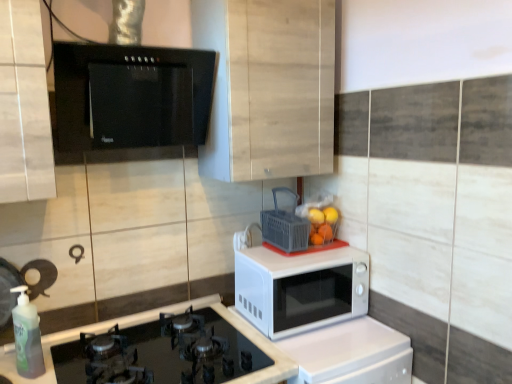
Identify the location of free space behind green translucent bottle at lower left. Image resolution: width=512 pixels, height=384 pixels. (59, 355).